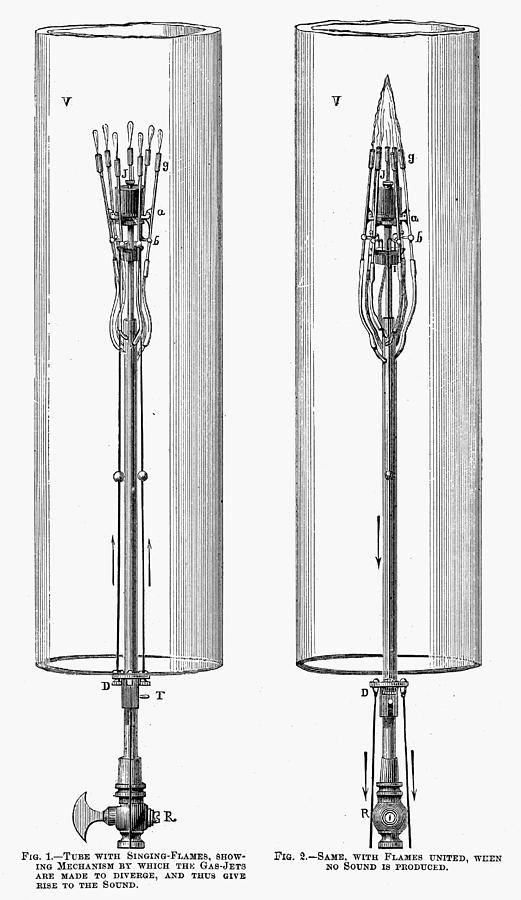
Where is `lantern`? The width and height of the screenshot is (521, 900). lantern is located at coordinates (277, 767).